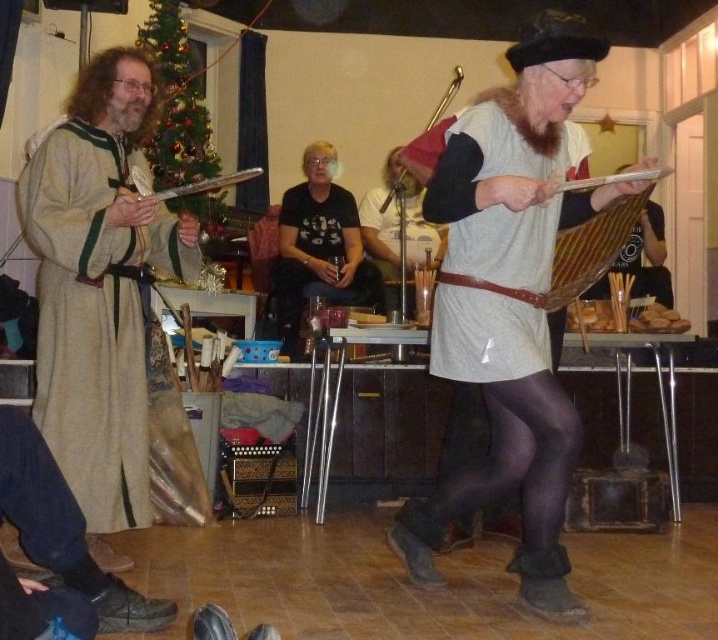
Consider the image. Who is positioned more to the right, matte gray tunic at center or matte black microphone at center?

matte gray tunic at center is more to the right.

Consider the image. Does matte gray tunic at center have a lesser height compared to matte black microphone at center?

Indeed, matte gray tunic at center has a lesser height compared to matte black microphone at center.

The height and width of the screenshot is (640, 718). Find the location of `matte gray tunic at center`. matte gray tunic at center is located at coordinates (462, 428).

Between beige woolen robe at left and matte gray tunic at center, which one appears on the left side from the viewer's perspective?

Positioned to the left is beige woolen robe at left.

Does beige woolen robe at left have a smaller size compared to matte gray tunic at center?

No.

Is point (103, 212) less distant than point (582, 176)?

That is True.

At what (x,y) coordinates should I click in order to perform the action: click on beige woolen robe at left. Please return your answer as a coordinate pair (x, y). The width and height of the screenshot is (718, 640). Looking at the image, I should click on (98, 289).

Locate an element on the screen. The width and height of the screenshot is (718, 640). beige woolen robe at left is located at coordinates (98, 289).

Does point (45, 186) come closer to viewer compared to point (349, 204)?

That is True.

Find the location of `beige woolen robe at left`. beige woolen robe at left is located at coordinates (98, 289).